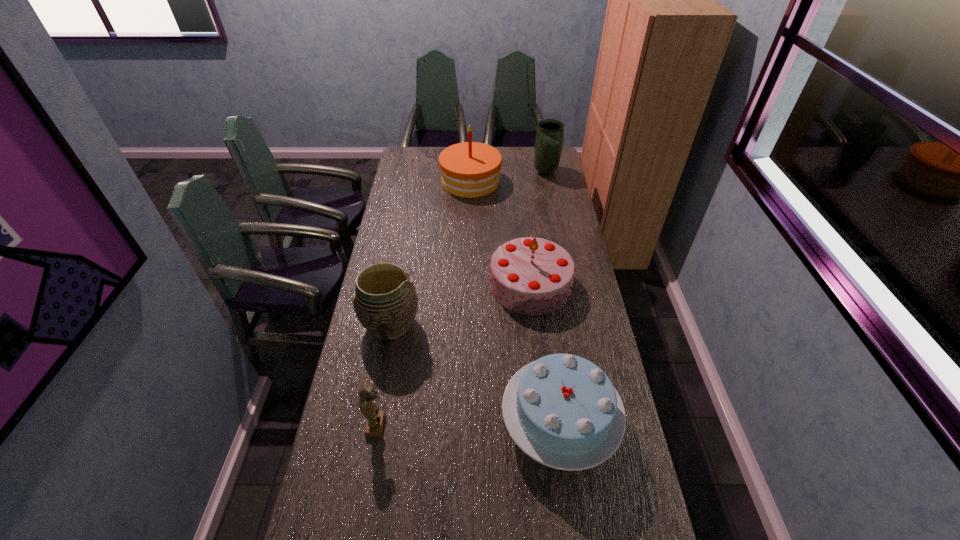
Identify the location of blank area located on the front-facing side of the figurine. The height and width of the screenshot is (540, 960). (444, 426).

Where is `vacant area situated on the left of the nearest birthday cake`? The height and width of the screenshot is (540, 960). vacant area situated on the left of the nearest birthday cake is located at coordinates (375, 424).

Locate an element on the screen. This screenshot has height=540, width=960. birthday cake that is positioned at the far edge is located at coordinates (470, 169).

I want to click on vase that is at the far edge, so click(x=549, y=138).

Where is `pottery present at the left edge`? pottery present at the left edge is located at coordinates (385, 302).

I want to click on figurine at the left edge, so click(367, 391).

In order to click on vase positioned at the right edge in this screenshot , I will do `click(549, 138)`.

At what (x,y) coordinates should I click in order to perform the action: click on object present at the far right corner. Please return your answer as a coordinate pair (x, y). The image size is (960, 540). Looking at the image, I should click on (549, 138).

This screenshot has width=960, height=540. Find the location of `blank space at the far edge of the desktop`. blank space at the far edge of the desktop is located at coordinates (439, 153).

Locate an element on the screen. This screenshot has height=540, width=960. vacant space at the left edge of the desktop is located at coordinates (415, 220).